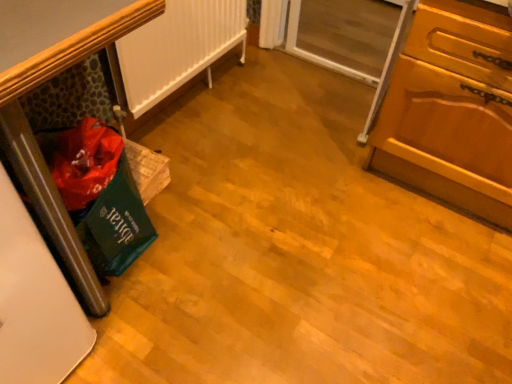
Find the location of `vacant area that is in front of wooden cabinet at right`. vacant area that is in front of wooden cabinet at right is located at coordinates (413, 279).